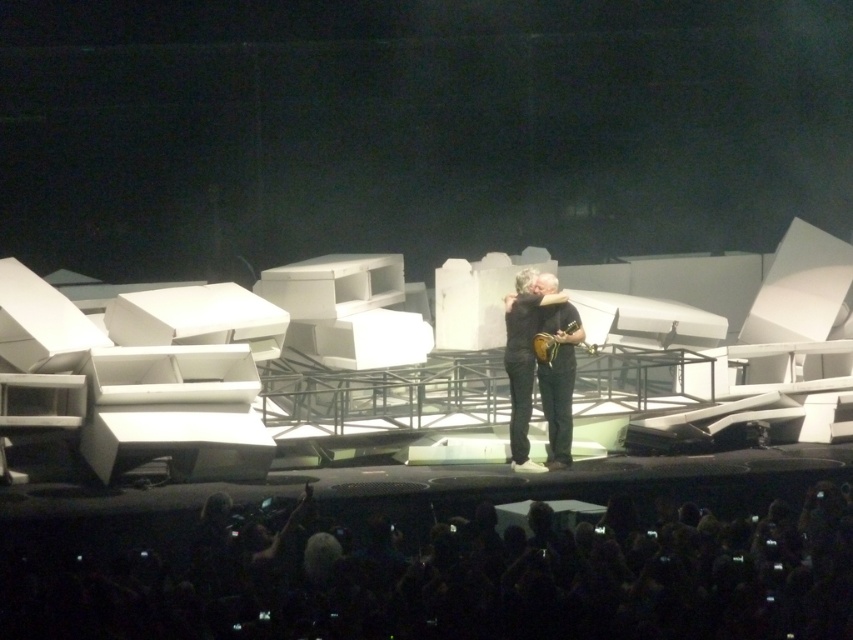
Question: Is matte brown guitar at center to the right of gold metallic guitar at center from the viewer's perspective?

Choices:
 (A) yes
 (B) no

Answer: (B)

Question: Can you confirm if matte brown guitar at center is smaller than gold metallic guitar at center?

Choices:
 (A) yes
 (B) no

Answer: (B)

Question: Is matte brown guitar at center above gold metallic guitar at center?

Choices:
 (A) yes
 (B) no

Answer: (B)